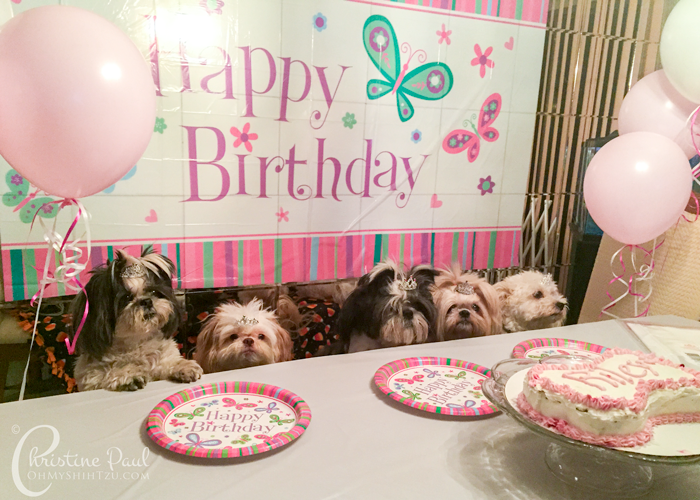
The width and height of the screenshot is (700, 500). What are the coordinates of `light gray table surface` in the screenshot? It's located at click(374, 460).